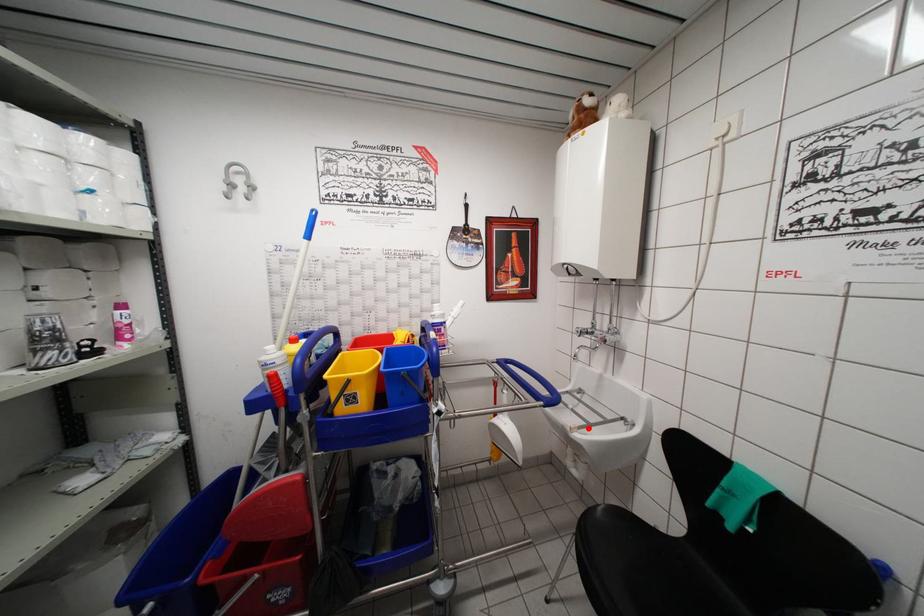
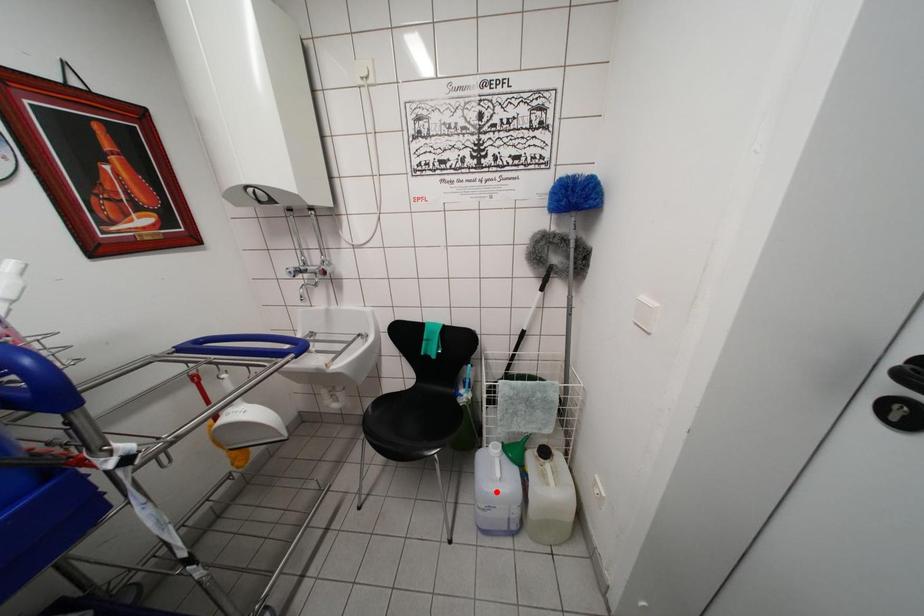
I am providing you with two images of the same scene from different viewpoints. A red point is marked on the first image and another point is marked on the second image. Are the points marked in image1 and image2 representing the same 3D position?

No